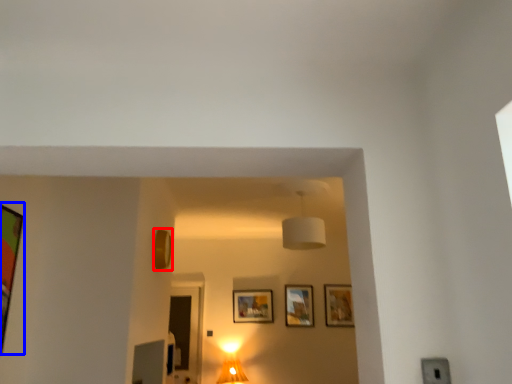
Question: Which object is further to the camera taking this photo, picture frame (highlighted by a red box) or picture frame (highlighted by a blue box)?

Choices:
 (A) picture frame
 (B) picture frame

Answer: (A)